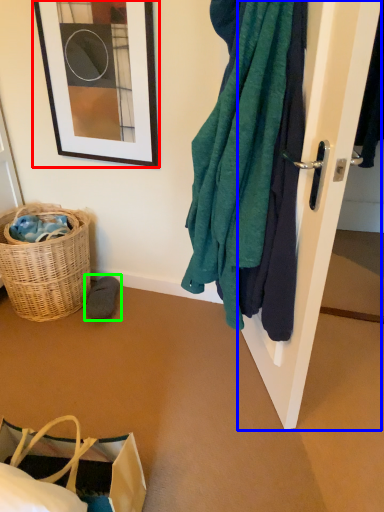
Question: Which is nearer to the picture frame (highlighted by a red box)? door (highlighted by a blue box) or footwear (highlighted by a green box).

Choices:
 (A) door
 (B) footwear

Answer: (B)